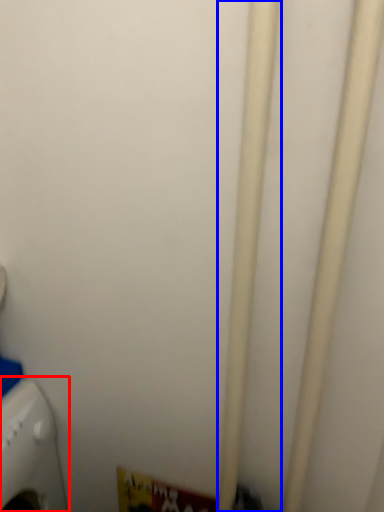
Question: Which object is closer to the camera taking this photo, home appliance (highlighted by a red box) or pipe (highlighted by a blue box)?

Choices:
 (A) home appliance
 (B) pipe

Answer: (B)